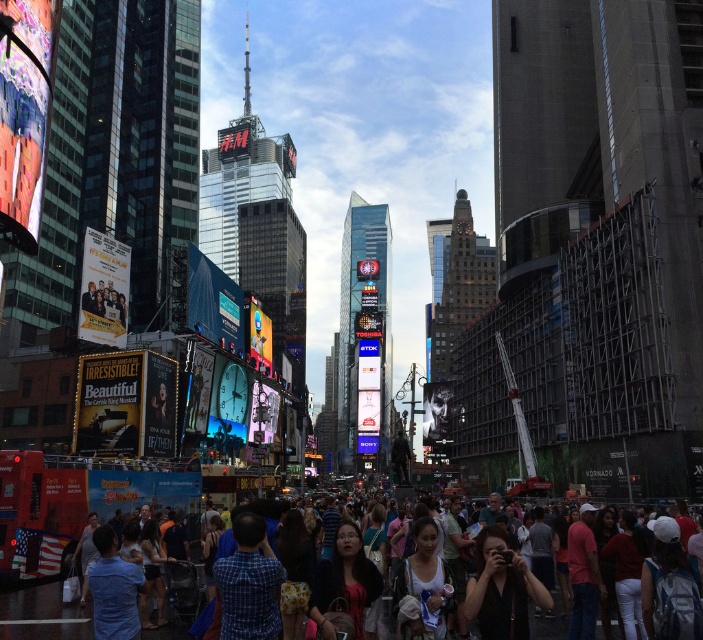
Question: Can you confirm if blue plaid shirt at center is bigger than multicolored casual attire at center?

Choices:
 (A) no
 (B) yes

Answer: (A)

Question: Which of the following is the closest to the observer?

Choices:
 (A) blue plaid shirt at center
 (B) multicolored casual attire at center

Answer: (B)

Question: Observing the image, what is the correct spatial positioning of blue plaid shirt at center in reference to multicolored casual attire at center?

Choices:
 (A) right
 (B) left

Answer: (B)

Question: Which object appears closest to the camera in this image?

Choices:
 (A) multicolored casual attire at center
 (B) blue plaid shirt at center

Answer: (A)

Question: Does blue plaid shirt at center have a smaller size compared to multicolored casual attire at center?

Choices:
 (A) no
 (B) yes

Answer: (B)